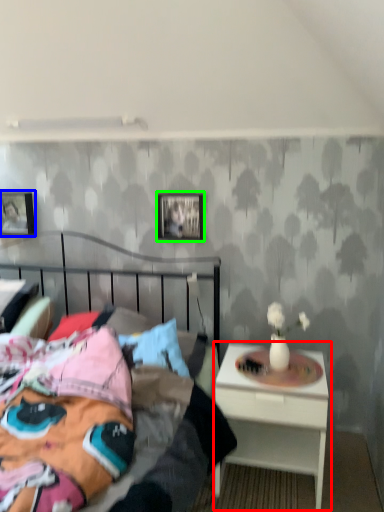
Question: Which is nearer to the nightstand (highlighted by a red box)? picture frame (highlighted by a blue box) or picture frame (highlighted by a green box).

Choices:
 (A) picture frame
 (B) picture frame

Answer: (B)